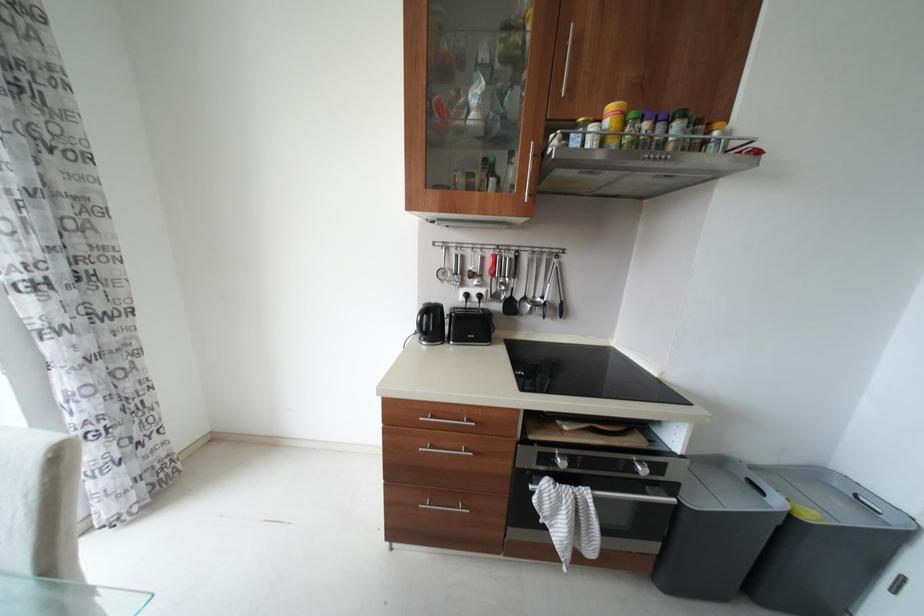
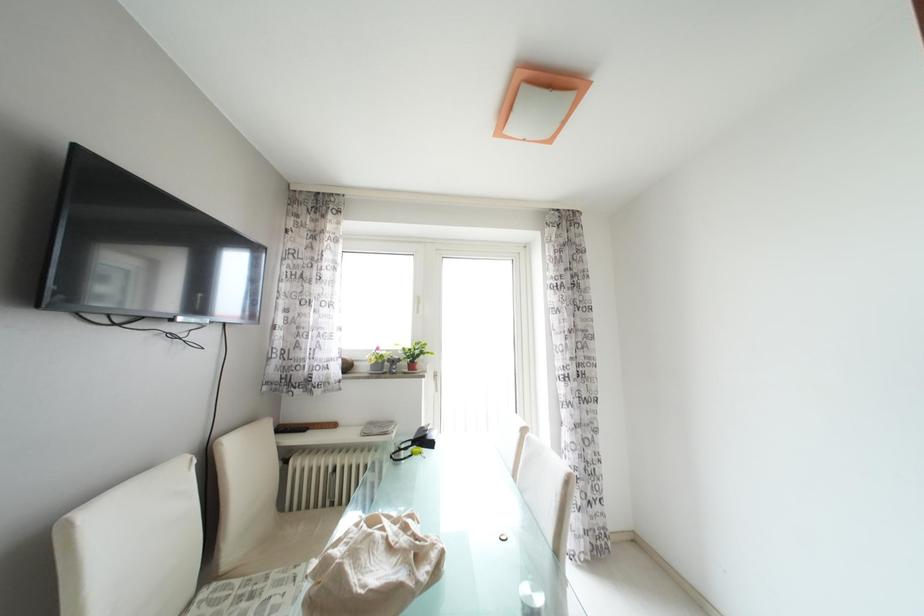
Question: How did the camera likely rotate?

Choices:
 (A) Left
 (B) Right
 (C) Up
 (D) Down

Answer: (A)